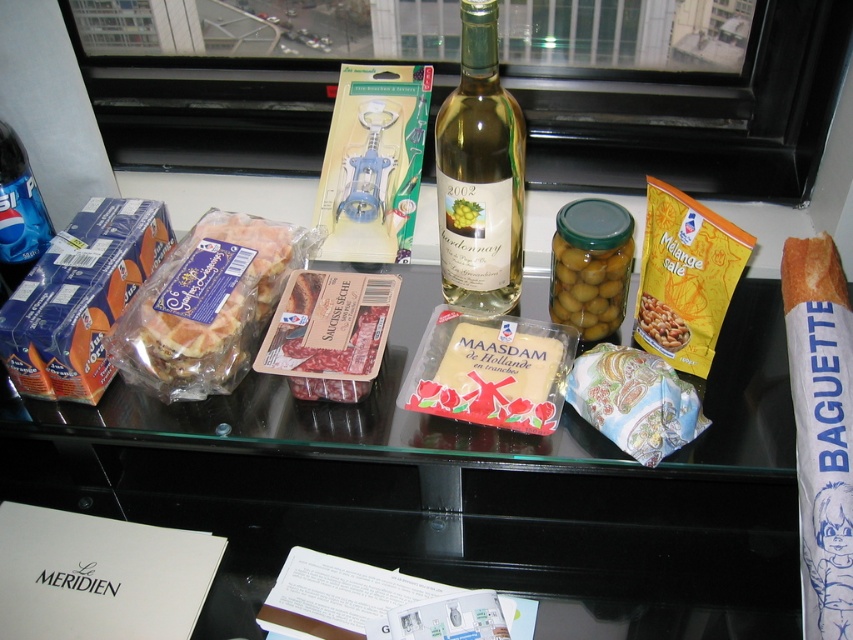
You are a customer at a cafe and want to grab both the translucent plastic sandwich at left and the matte plastic baguette at center. Since they are both on the same table, which one do you need to move first to reach the other?

You need to move the translucent plastic sandwich at left first because the matte plastic baguette at center is behind it, so moving the sandwich will allow access to the baguette.

You are a guest at a dinner party and you want to pour wine into a glass. The green glass bottle at center is your wine bottle. Where should you place the dark red glossy meat at center so it doesn not block the bottle?

The dark red glossy meat at center should be placed away from the green glass bottle at center since the bottle is much taller and needs space to be poured into a glass without obstruction.